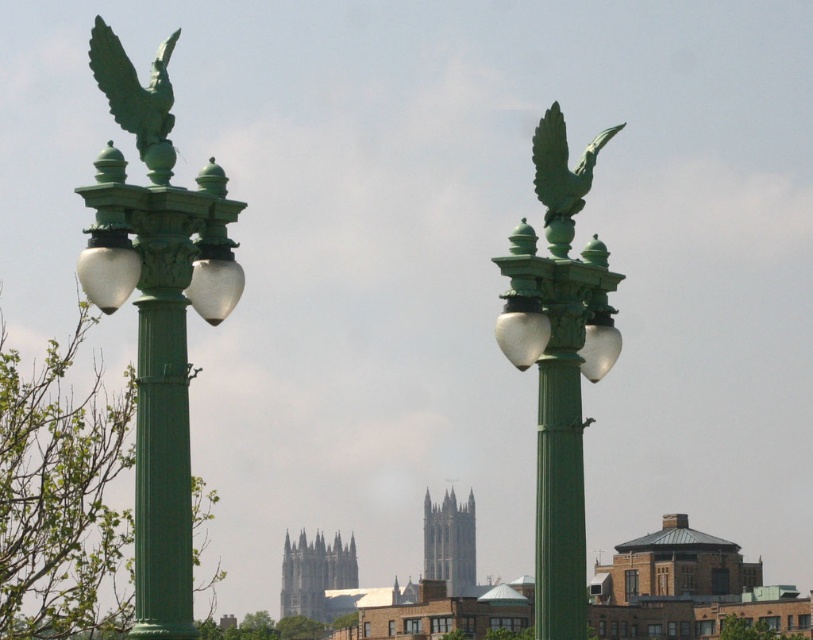
Question: Observing the image, what is the correct spatial positioning of green polished metal street light at upper center in reference to gray stone tower at center?

Choices:
 (A) left
 (B) right

Answer: (B)

Question: Observing the image, what is the correct spatial positioning of green stone tower at center in reference to green matte eagle at upper right?

Choices:
 (A) above
 (B) below

Answer: (B)

Question: Which object is farther from the camera taking this photo?

Choices:
 (A) green patina eagle at upper left
 (B) green stone tower at center
 (C) green polished metal street light at upper center
 (D) green matte/light green textured street light at left

Answer: (B)

Question: Which of the following is the closest to the observer?

Choices:
 (A) green polished metal street light at upper center
 (B) green matte eagle at upper right
 (C) green matte/light green textured street light at left
 (D) green stone tower at center

Answer: (C)

Question: Is green matte/light green textured street light at left to the left of green stone tower at center from the viewer's perspective?

Choices:
 (A) yes
 (B) no

Answer: (B)

Question: Which of the following is the farthest from the observer?

Choices:
 (A) (446, 547)
 (B) (562, 481)
 (C) (105, 64)
 (D) (550, 145)

Answer: (A)